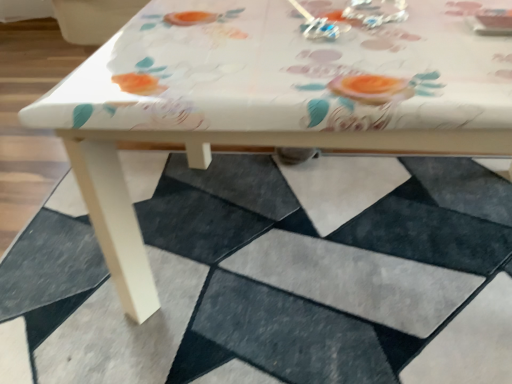
This screenshot has height=384, width=512. I want to click on free spot above white matte rug at lower center (from a real-world perspective), so click(x=277, y=272).